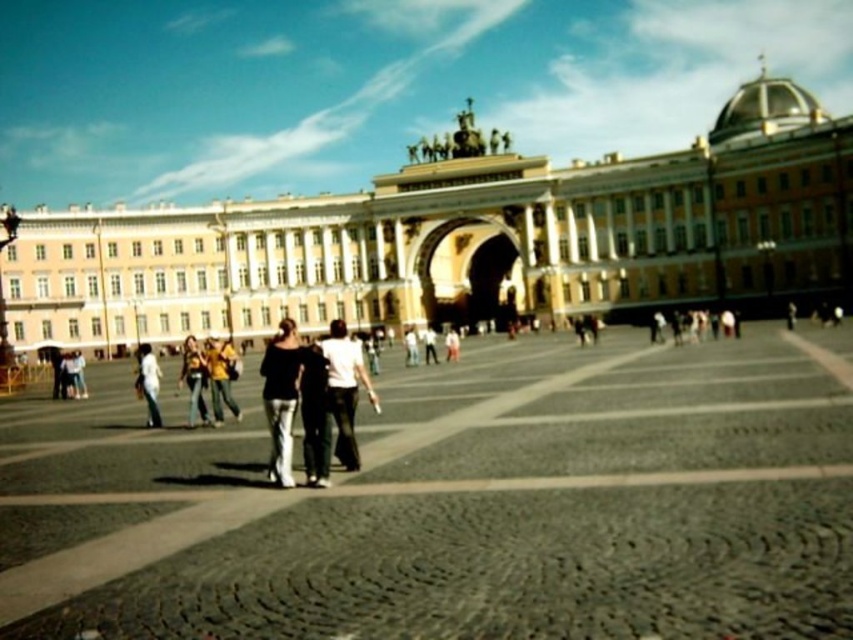
Between matte black clothing at center and denim pants at center, which one is positioned higher?

matte black clothing at center

The width and height of the screenshot is (853, 640). Find the location of `matte black clothing at center`. matte black clothing at center is located at coordinates (311, 396).

Locate an element on the screen. This screenshot has height=640, width=853. matte black clothing at center is located at coordinates (311, 396).

Identify the location of matte black clothing at center. The image size is (853, 640). (311, 396).

Between point (685, 189) and point (312, 422), which one is positioned in front?

Point (312, 422) is in front.

Locate an element on the screen. This screenshot has width=853, height=640. yellow stone building at center is located at coordinates (460, 237).

At what (x,y) coordinates should I click in order to perform the action: click on yellow stone building at center. Please return your answer as a coordinate pair (x, y). Looking at the image, I should click on (460, 237).

Who is positioned more to the right, yellow stone building at center or matte black top at center?

yellow stone building at center

The height and width of the screenshot is (640, 853). I want to click on yellow stone building at center, so click(460, 237).

Where is `yellow stone building at center`? Image resolution: width=853 pixels, height=640 pixels. yellow stone building at center is located at coordinates (460, 237).